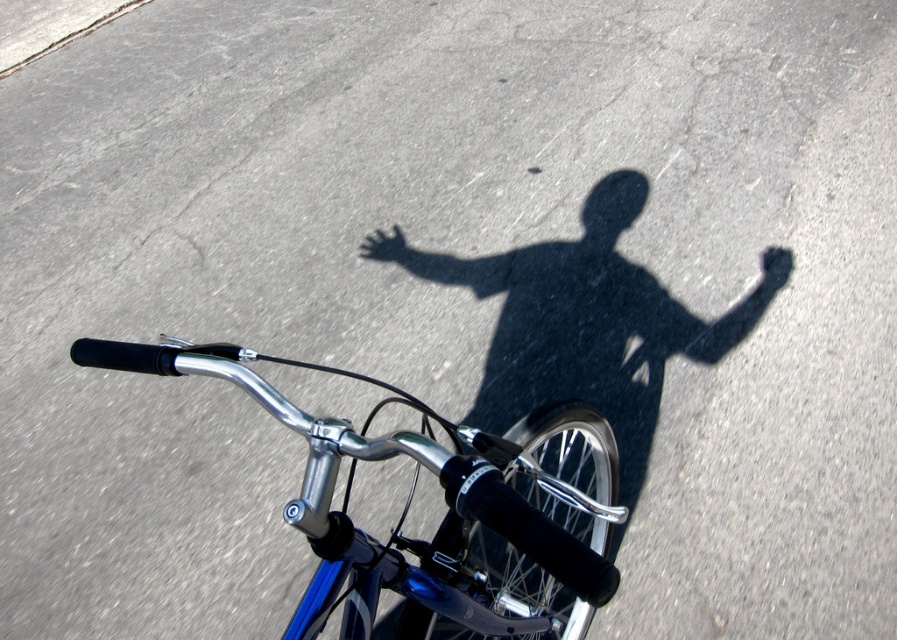
You are standing in the scene and see the shiny blue bicycle handlebars at center and the matte black hand at center. Which object is positioned more to the left?

The matte black hand at center is positioned more to the left because the shiny blue bicycle handlebars at center are to the right of it.

You are a delivery person needing to place a package on the shiny blue bicycle handlebars at center and the matte black hand at center. Which object is closer to you so you can place the package first?

The shiny blue bicycle handlebars at center is in front of the matte black hand at center, so you can place the package on the shiny blue bicycle handlebars at center first.

You are a photographer trying to capture the shiny blue bicycle handlebars at center and the matte black hand at center in a single shot. Based on their sizes in the image, which object would appear larger in your photo?

The shiny blue bicycle handlebars at center would appear larger in the photo because they are bigger than the matte black hand at center.